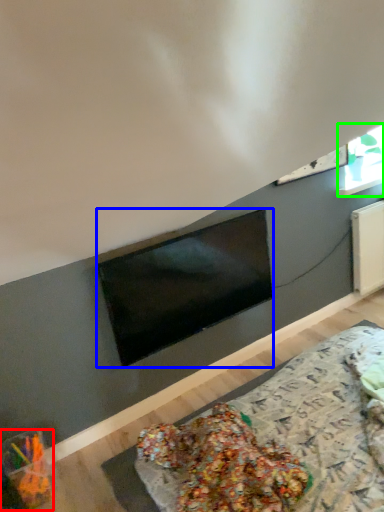
Question: Estimate the real-world distances between objects in this image. Which object is closer to food (highlighted by a red box), television (highlighted by a blue box) or window (highlighted by a green box)?

Choices:
 (A) television
 (B) window

Answer: (A)